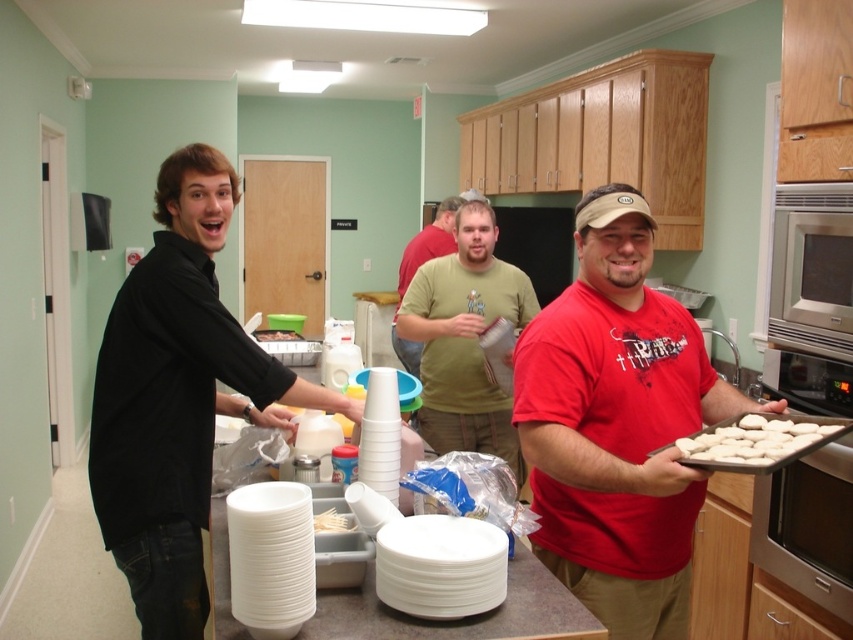
Question: Observing the image, what is the correct spatial positioning of red matte shirt at center in reference to green matte t-shirt at center?

Choices:
 (A) above
 (B) below

Answer: (B)

Question: Can you confirm if red matte shirt at center is wider than white doughy balls at right?

Choices:
 (A) yes
 (B) no

Answer: (A)

Question: Among these points, which one is farthest from the camera?

Choices:
 (A) (471, 268)
 (B) (397, 285)
 (C) (183, 468)
 (D) (299, 336)

Answer: (B)

Question: Which object appears closest to the camera in this image?

Choices:
 (A) red matte shirt at center
 (B) green matte t-shirt at center
 (C) white doughy balls at right

Answer: (C)

Question: Estimate the real-world distances between objects in this image. Which object is closer to the green plastic container at center?

Choices:
 (A) white doughy balls at right
 (B) green matte shirt at center

Answer: (B)

Question: Is the position of white plastic forks at center more distant than that of green plastic container at center?

Choices:
 (A) yes
 (B) no

Answer: (B)